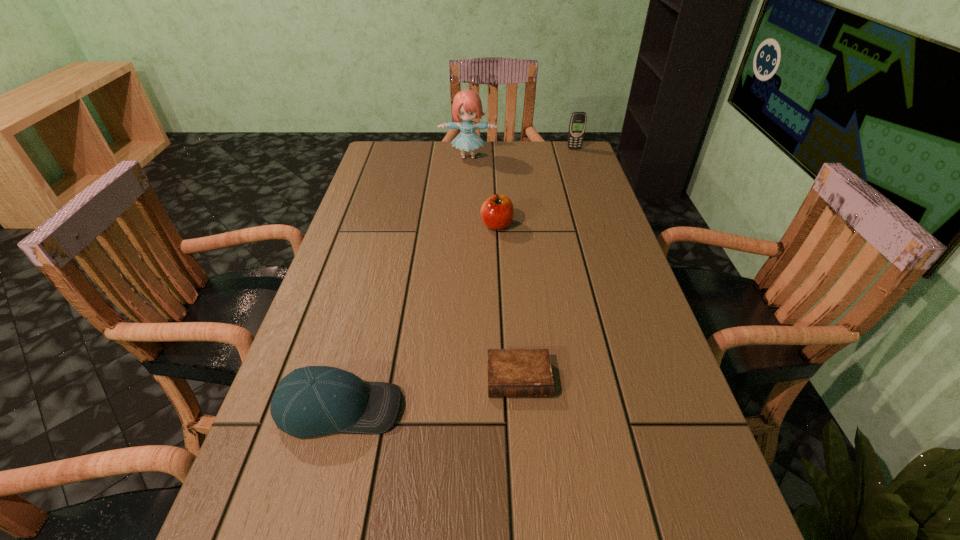
This screenshot has width=960, height=540. In order to click on free space located 0.200m on the right of the baseball cap in this screenshot , I will do `click(508, 408)`.

Where is `vacant region located 0.200m on the spine side of the diary`? Image resolution: width=960 pixels, height=540 pixels. vacant region located 0.200m on the spine side of the diary is located at coordinates pos(529,511).

This screenshot has height=540, width=960. In order to click on doll that is at the far edge in this screenshot , I will do `click(467, 105)`.

The height and width of the screenshot is (540, 960). I want to click on cellular telephone that is positioned at the far edge, so click(x=577, y=126).

Identify the location of object located at the left edge. Image resolution: width=960 pixels, height=540 pixels. (311, 401).

This screenshot has height=540, width=960. In order to click on object located at the right edge in this screenshot , I will do `click(577, 126)`.

You are a GUI agent. You are given a task and a screenshot of the screen. Output one action in this format:
    pyautogui.click(x=<x>, y=<y>)
    Task: Click on the object located at the far right corner
    Image resolution: width=960 pixels, height=540 pixels.
    Given the screenshot: What is the action you would take?
    pyautogui.click(x=577, y=126)

In the image, there is a desktop. What are the coordinates of `vacant space at the far edge` in the screenshot? It's located at (488, 166).

Find the location of a particular element. vacant point at the left edge is located at coordinates (328, 289).

In the image, there is a desktop. Where is `vacant space at the right edge`? vacant space at the right edge is located at coordinates (574, 227).